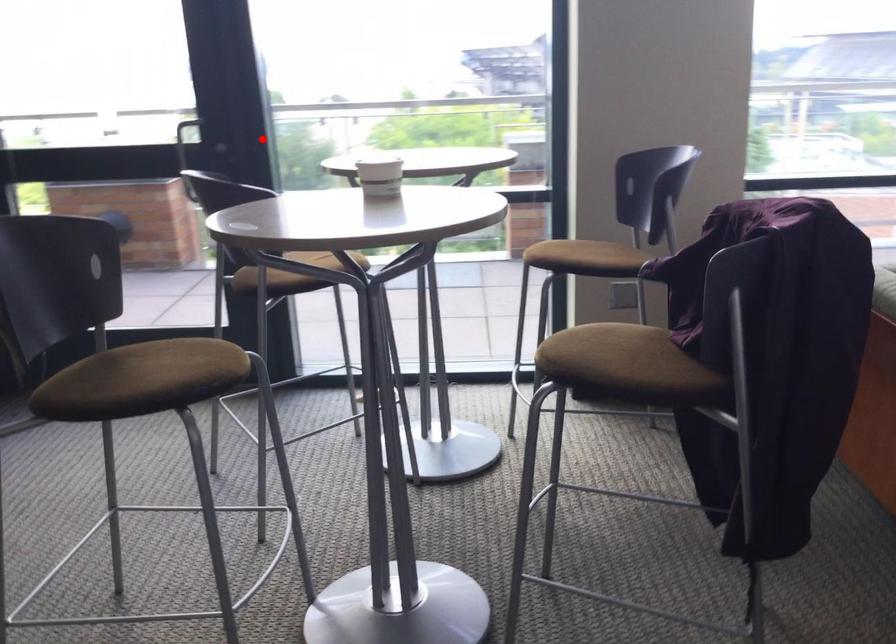
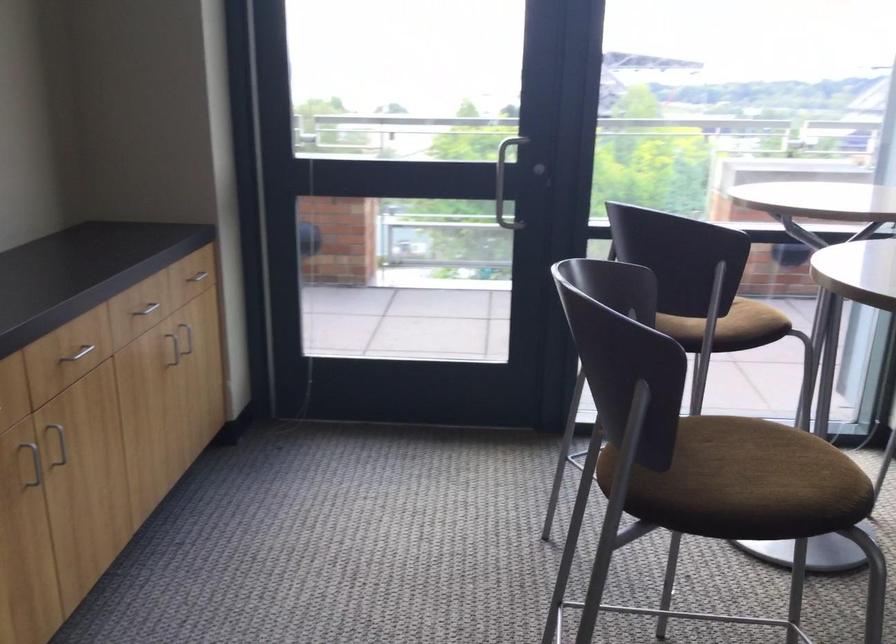
Where in the second image is the point corresponding to the highlighted location from the first image?

(503, 173)